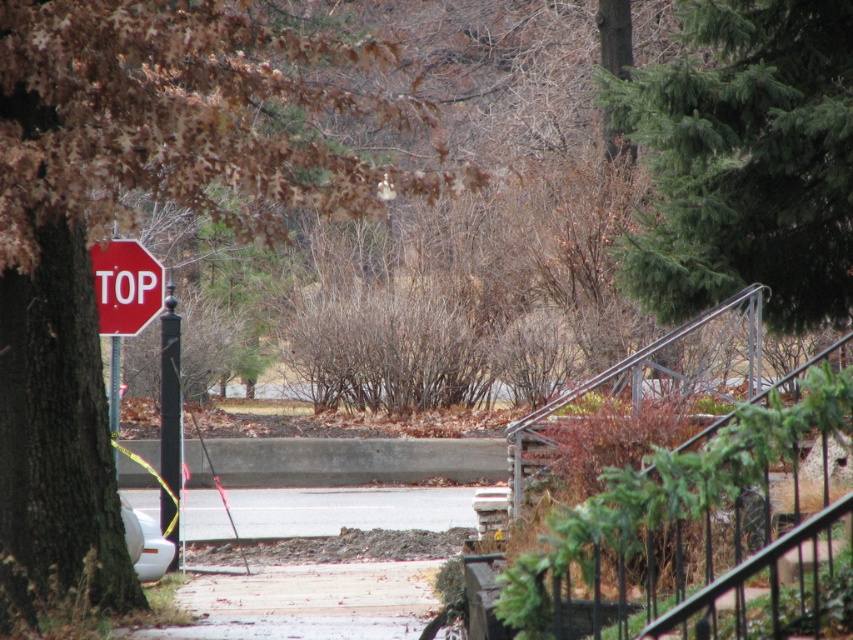
You are a pedestrian walking along the gray asphalt pavement at center and the black metal pole at left. Which object is closer to your left side as you face forward?

The black metal pole at left is closer to your left side as you face forward because it is positioned to the left of the gray asphalt pavement at center.

You are a delivery person who needs to drive a 1.2 meter wide cart through the path between the gray asphalt pavement at center and the black metal pole at left. Can your cart fit through the space?

The gray asphalt pavement at center is wider than the black metal pole at left, so the cart can fit through the space as long as it stays within the pavement area.